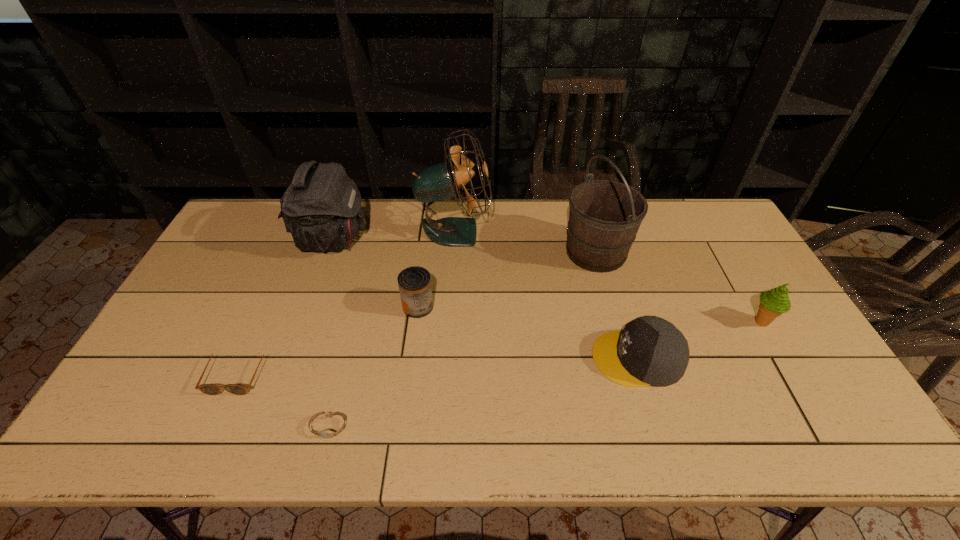
I want to click on blank space that satisfies the following two spatial constraints: 1. on the front-facing side of the fan for air flow; 2. on the back side of the bucket, so click(453, 252).

The image size is (960, 540). Find the location of `vacant space that satisfies the following two spatial constraints: 1. on the front-facing side of the fan for air flow; 2. on the left side of the bucket`. vacant space that satisfies the following two spatial constraints: 1. on the front-facing side of the fan for air flow; 2. on the left side of the bucket is located at coordinates (453, 252).

Locate an element on the screen. The width and height of the screenshot is (960, 540). vacant space that satisfies the following two spatial constraints: 1. on the open flap of the can; 2. on the right side of the third tallest object is located at coordinates (308, 306).

The image size is (960, 540). I want to click on vacant region that satisfies the following two spatial constraints: 1. on the front-facing side of the cap; 2. on the face of the watch, so click(658, 427).

Where is `free point that satisfies the following two spatial constraints: 1. on the back side of the can; 2. on the right side of the bucket`? The width and height of the screenshot is (960, 540). free point that satisfies the following two spatial constraints: 1. on the back side of the can; 2. on the right side of the bucket is located at coordinates (425, 252).

Image resolution: width=960 pixels, height=540 pixels. I want to click on vacant point that satisfies the following two spatial constraints: 1. on the open flap of the rightmost object; 2. on the left side of the third tallest object, so click(303, 322).

Identify the location of free space that satisfies the following two spatial constraints: 1. on the front-facing side of the cap; 2. on the face of the nearest object. (658, 427).

Find the location of a particular element. free spot that satisfies the following two spatial constraints: 1. on the open flap of the shoulder bag; 2. on the left side of the can is located at coordinates (308, 306).